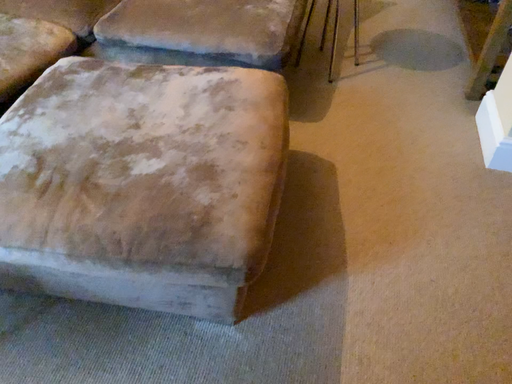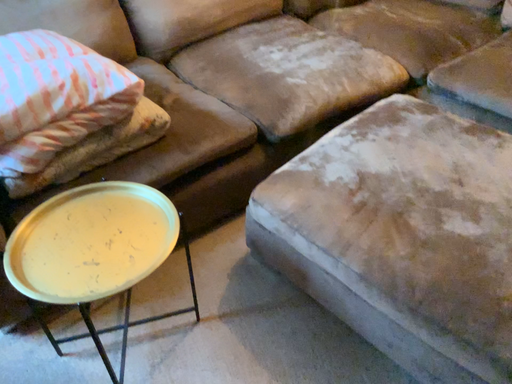
Question: Which way did the camera rotate in the video?

Choices:
 (A) rotated downward
 (B) rotated upward

Answer: (B)